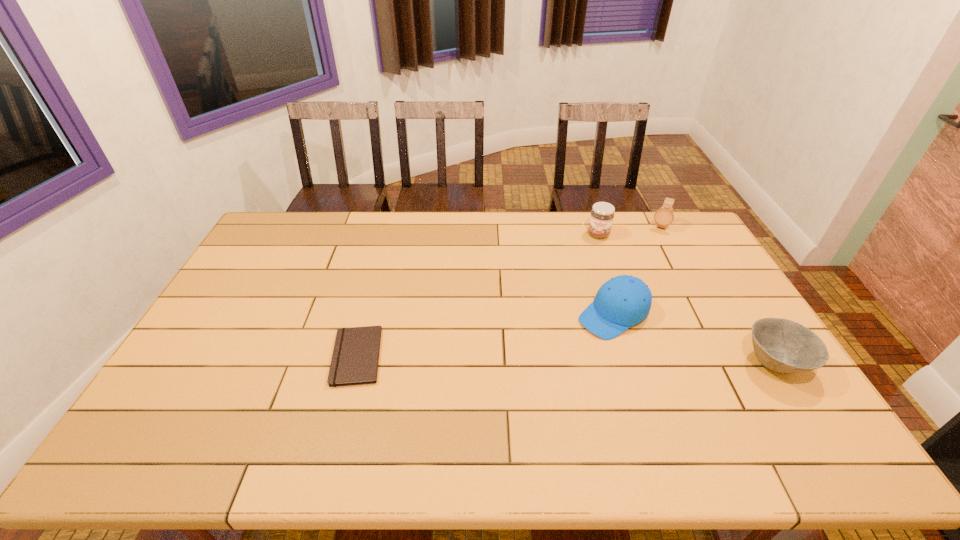
At what (x,y) coordinates should I click in order to perform the action: click on checkbook. Please return your answer as a coordinate pair (x, y). The height and width of the screenshot is (540, 960). Looking at the image, I should click on (355, 358).

Image resolution: width=960 pixels, height=540 pixels. Find the location of `the shortest object`. the shortest object is located at coordinates (355, 358).

I want to click on bowl, so click(784, 346).

At what (x,y) coordinates should I click in order to perform the action: click on jam. Please return your answer as a coordinate pair (x, y). This screenshot has height=540, width=960. Looking at the image, I should click on (602, 214).

You are a GUI agent. You are given a task and a screenshot of the screen. Output one action in this format:
    pyautogui.click(x=<x>, y=<y>)
    Task: Click on the cap
    This screenshot has width=960, height=540.
    Given the screenshot: What is the action you would take?
    pyautogui.click(x=623, y=301)

Identify the location of watch. The width and height of the screenshot is (960, 540). (664, 216).

Where is `vacant area located on the right of the shortest object`? The height and width of the screenshot is (540, 960). vacant area located on the right of the shortest object is located at coordinates (440, 356).

The height and width of the screenshot is (540, 960). What are the coordinates of `free space located 0.110m on the back of the fourth tallest object` in the screenshot? It's located at (742, 311).

I want to click on blank space located on the front label of the jam, so click(593, 267).

Find the location of `vacant space located 0.130m on the front label of the jam`. vacant space located 0.130m on the front label of the jam is located at coordinates (594, 262).